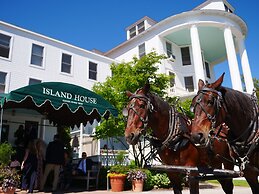
Identify the location of bench. (91, 182).